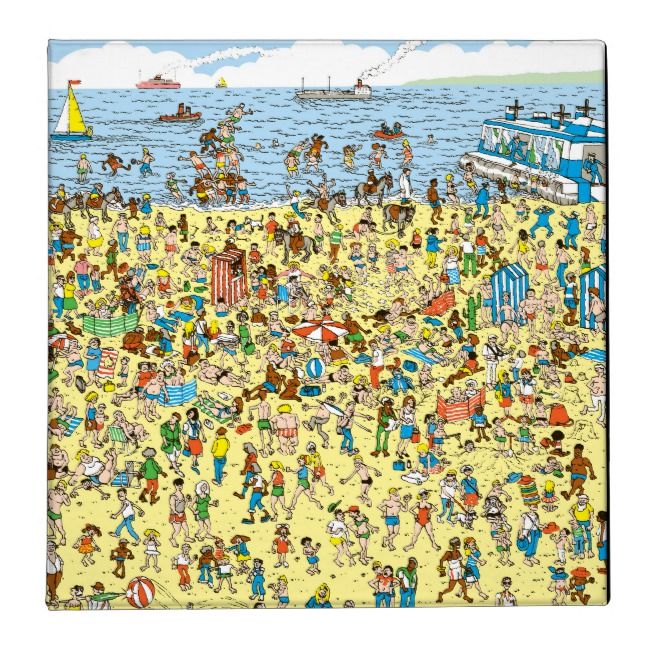
I want to click on towels, so [65, 424], [184, 385], [209, 408], [106, 366], [424, 357], [586, 352].